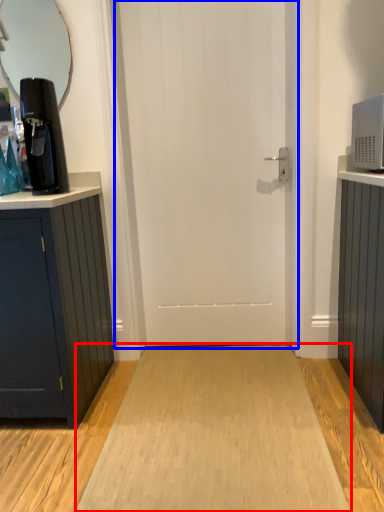
Question: Which of the following is the closest to the observer, plain (highlighted by a red box) or door (highlighted by a blue box)?

Choices:
 (A) plain
 (B) door

Answer: (A)